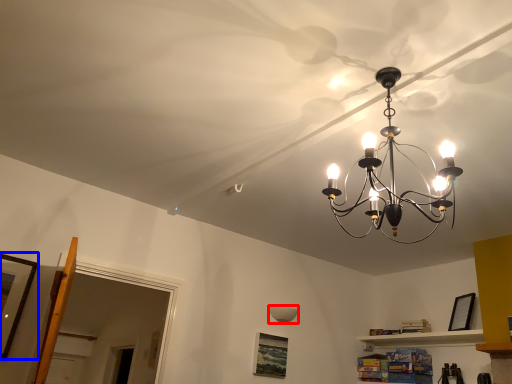
Question: Which of the following is the closest to the observer, lamp (highlighted by a red box) or picture frame (highlighted by a blue box)?

Choices:
 (A) lamp
 (B) picture frame

Answer: (B)